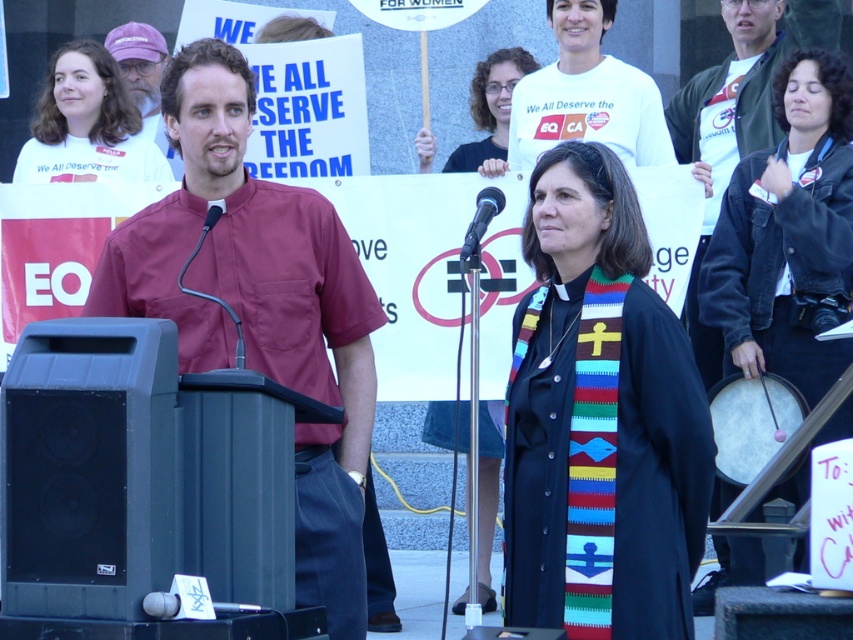
Question: Does maroon shirt at center have a lesser width compared to white t-shirt at upper center?

Choices:
 (A) yes
 (B) no

Answer: (A)

Question: Which of the following is the closest to the observer?

Choices:
 (A) (483, 115)
 (B) (791, 422)
 (C) (152, 140)

Answer: (B)

Question: Which of the following is the closest to the observer?

Choices:
 (A) purple fabric cap at upper left
 (B) black fabric stole at center
 (C) white t-shirt at upper center

Answer: (B)

Question: Which object appears farthest from the camera in this image?

Choices:
 (A) black woolen robe at center
 (B) maroon shirt at center
 (C) white t-shirt at upper center
 (D) black leather jacket at lower right

Answer: (C)

Question: Considering the relative positions of matte white t-shirt at upper left and purple fabric cap at upper left in the image provided, where is matte white t-shirt at upper left located with respect to purple fabric cap at upper left?

Choices:
 (A) above
 (B) below

Answer: (B)

Question: Can you confirm if black plastic speaker at lower left is positioned to the right of matte white t-shirt at upper left?

Choices:
 (A) no
 (B) yes

Answer: (B)